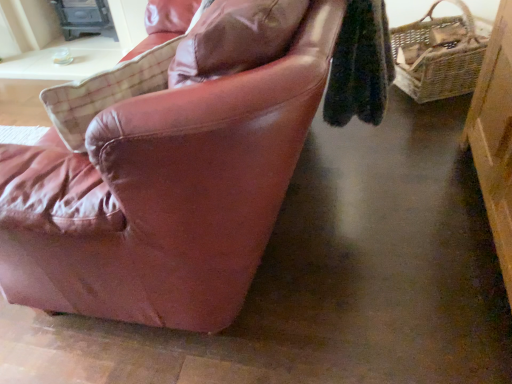
Question: Is leather chair at left wider or thinner than woven brown picnic basket at right?

Choices:
 (A) thin
 (B) wide

Answer: (B)

Question: Is point (185, 256) positioned closer to the camera than point (462, 89)?

Choices:
 (A) farther
 (B) closer

Answer: (B)

Question: Do you think leather chair at left is within woven brown picnic basket at right, or outside of it?

Choices:
 (A) outside
 (B) inside

Answer: (A)

Question: In terms of width, does woven brown picnic basket at right look wider or thinner when compared to leather chair at left?

Choices:
 (A) thin
 (B) wide

Answer: (A)

Question: Is woven brown picnic basket at right inside or outside of leather chair at left?

Choices:
 (A) outside
 (B) inside

Answer: (A)

Question: In terms of height, does woven brown picnic basket at right look taller or shorter compared to leather chair at left?

Choices:
 (A) short
 (B) tall

Answer: (B)

Question: Is point (431, 87) positioned closer to the camera than point (266, 205)?

Choices:
 (A) closer
 (B) farther

Answer: (B)